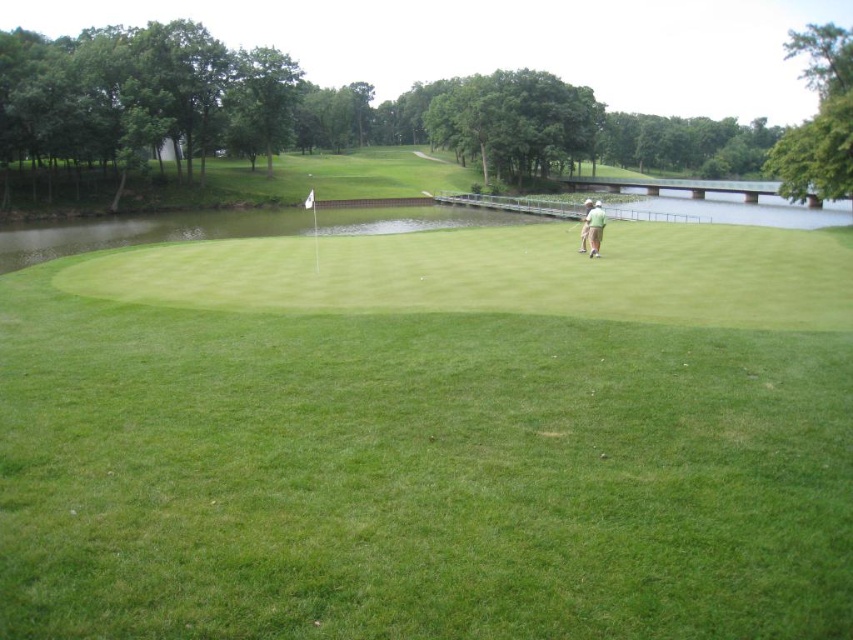
Which is below, green fabric shirt at right or metallic silver golf club at right?

metallic silver golf club at right is lower down.

Describe the element at coordinates (595, 227) in the screenshot. I see `green fabric shirt at right` at that location.

At what (x,y) coordinates should I click in order to perform the action: click on green fabric shirt at right. Please return your answer as a coordinate pair (x, y). This screenshot has height=640, width=853. Looking at the image, I should click on (595, 227).

Can you confirm if green grassy golf course at center is bigger than metallic silver golf club at right?

Yes, green grassy golf course at center is bigger than metallic silver golf club at right.

Does green grassy golf course at center have a greater height compared to metallic silver golf club at right?

Yes, green grassy golf course at center is taller than metallic silver golf club at right.

Locate an element on the screen. This screenshot has width=853, height=640. green grassy golf course at center is located at coordinates (431, 438).

Is green grassy golf course at center positioned behind green fabric shirt at right?

No, green grassy golf course at center is closer to the viewer.

Can you confirm if green grassy golf course at center is positioned to the left of green fabric shirt at right?

Yes, green grassy golf course at center is to the left of green fabric shirt at right.

Find the location of a particular element. The height and width of the screenshot is (640, 853). green grassy golf course at center is located at coordinates (431, 438).